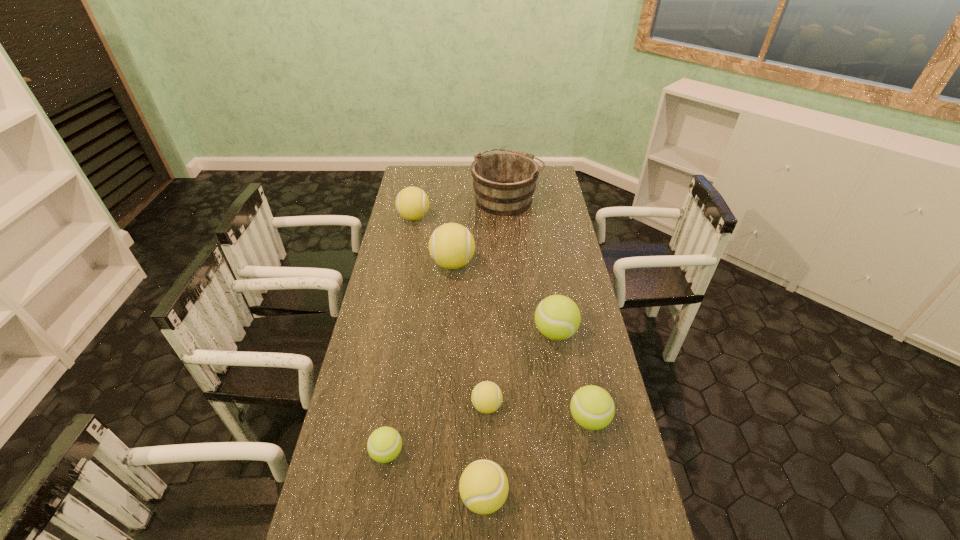
Where is `object located in the far edge section of the desktop`? Image resolution: width=960 pixels, height=540 pixels. object located in the far edge section of the desktop is located at coordinates (504, 182).

The height and width of the screenshot is (540, 960). In order to click on wine bucket that is positioned at the right edge in this screenshot , I will do `click(504, 182)`.

The width and height of the screenshot is (960, 540). In order to click on object situated at the far right corner in this screenshot , I will do (504, 182).

Locate an element on the screen. free location at the far edge is located at coordinates (444, 183).

Where is `vacant region at the left edge of the desktop`? The height and width of the screenshot is (540, 960). vacant region at the left edge of the desktop is located at coordinates (389, 234).

At what (x,y) coordinates should I click in order to perform the action: click on free space at the right edge. Please return your answer as a coordinate pair (x, y). The width and height of the screenshot is (960, 540). Looking at the image, I should click on (569, 343).

Image resolution: width=960 pixels, height=540 pixels. I want to click on vacant area at the far left corner of the desktop, so tap(412, 186).

The height and width of the screenshot is (540, 960). I want to click on free space between the smallest yellow tennis ball and the leftmost yellow tennis ball, so (450, 312).

At what (x,y) coordinates should I click in order to perform the action: click on free space that is in between the smallest yellow tennis ball and the biggest green tennis ball. Please return your answer as a coordinate pair (x, y). This screenshot has height=540, width=960. Looking at the image, I should click on (521, 369).

Where is `vacant space that is in between the biggest green tennis ball and the leftmost yellow tennis ball`? This screenshot has width=960, height=540. vacant space that is in between the biggest green tennis ball and the leftmost yellow tennis ball is located at coordinates (485, 275).